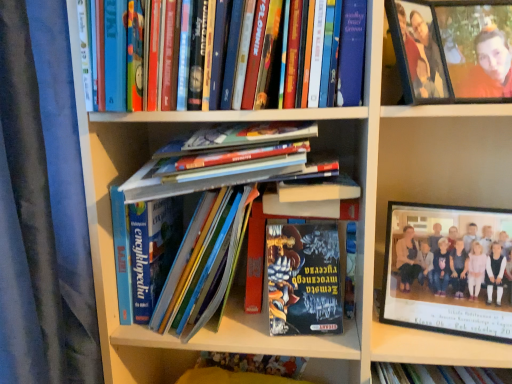
Question: Considering the positions of hardcover book at center, the 2th book from the top, and shiny metallic book at center, which is the first book in bottom-to-top order, in the image, is hardcover book at center, the 2th book from the top, wider or thinner than shiny metallic book at center, which is the first book in bottom-to-top order,?

Choices:
 (A) thin
 (B) wide

Answer: (B)

Question: Relative to shiny metallic book at center, which is the 5th book in top-to-bottom order, is hardcover book at center, which ranks as the fourth book in bottom-to-top order, in front or behind?

Choices:
 (A) behind
 (B) front

Answer: (B)

Question: Considering the real-world distances, which object is farthest from the hardcover book at upper center, arranged as the 1th book when viewed from the top?

Choices:
 (A) hardcover books at center, which is counted as the fourth book, starting from the top
 (B) hardcover books at center, marked as the third book in a top-to-bottom arrangement
 (C) hardcover book at center, which ranks as the fourth book in bottom-to-top order
 (D) black plastic frame at upper right
 (E) shiny metallic book at center, which is the 5th book in top-to-bottom order

Answer: (E)

Question: Which object is positioned farthest from the shiny metallic book at center, which is the 5th book in top-to-bottom order?

Choices:
 (A) matte plastic frame at upper right
 (B) black plastic frame at upper right
 (C) hardcover books at center, the third book from the bottom
 (D) wooden photo frame at upper right
 (E) hardcover books at center, which is counted as the fourth book, starting from the top

Answer: (D)